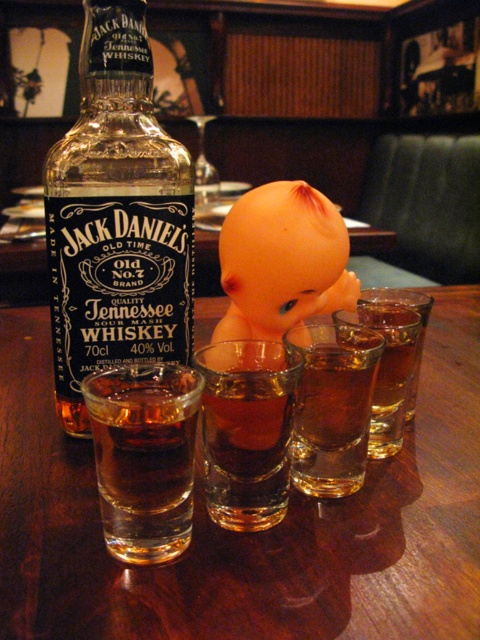
Question: Which point is farther to the camera?

Choices:
 (A) (295, 461)
 (B) (396, 296)
 (C) (116, 424)
 (D) (444, 493)

Answer: (B)

Question: Does transparent glass table at center appear under amber liquid glass at lower left?

Choices:
 (A) no
 (B) yes

Answer: (A)

Question: Among these points, which one is nearest to the camera?

Choices:
 (A) (170, 344)
 (B) (108, 458)

Answer: (B)

Question: Can you confirm if translucent glass bottle at left is positioned below translucent glass shot glass at lower center?

Choices:
 (A) no
 (B) yes

Answer: (A)

Question: Based on their relative distances, which object is farther from the amber liquid at center?

Choices:
 (A) amber liquid glass at lower left
 (B) transparent glass table at center

Answer: (B)

Question: Can you confirm if transparent glass table at center is positioned above amber liquid glass at lower left?

Choices:
 (A) yes
 (B) no

Answer: (A)